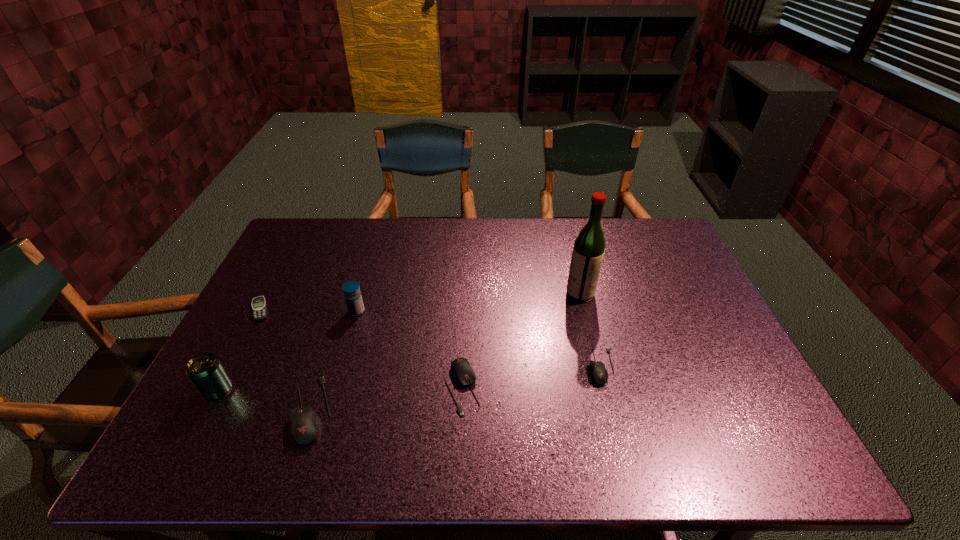
The width and height of the screenshot is (960, 540). I want to click on free space between the tallest object and the medicine, so click(x=468, y=302).

Find the location of a particular element. The image size is (960, 540). vacant space that's between the leftmost mouse and the fifth object from left to right is located at coordinates (387, 399).

Locate an element on the screen. vacant space that's between the medicine and the beer can is located at coordinates coord(287,351).

This screenshot has width=960, height=540. Find the location of `free space that is in between the shortest mouse and the medicine`. free space that is in between the shortest mouse and the medicine is located at coordinates (479, 339).

The image size is (960, 540). Find the location of `free space between the medicine and the liquor`. free space between the medicine and the liquor is located at coordinates (468, 302).

Locate an element on the screen. Image resolution: width=960 pixels, height=540 pixels. vacant point located between the medicine and the beer can is located at coordinates (287, 351).

At what (x,y) coordinates should I click in order to perform the action: click on unoccupied area between the leftmost mouse and the tallest object. Please return your answer as a coordinate pair (x, y). The image size is (960, 540). Looking at the image, I should click on (445, 352).

At what (x,y) coordinates should I click in order to perform the action: click on vacant point located between the shortest mouse and the liquor. Please return your answer as a coordinate pair (x, y). Looking at the image, I should click on (590, 330).

Locate which object is the second closest to the leftmost mouse. Please provide its 2D coordinates. Your answer should be formatted as a tuple, i.e. [(x, y)], where the tuple contains the x and y coordinates of a point satisfying the conditions above.

[(351, 289)]

Identify which object is located as the nearest to the beer can. Please provide its 2D coordinates. Your answer should be formatted as a tuple, i.e. [(x, y)], where the tuple contains the x and y coordinates of a point satisfying the conditions above.

[(305, 425)]